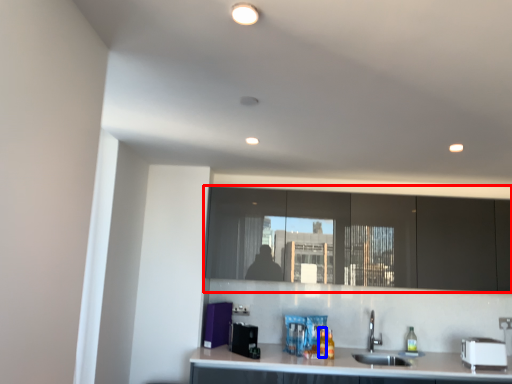
Question: Which point is closer to the camera, cabinetry (highlighted by a red box) or bottle (highlighted by a blue box)?

Choices:
 (A) cabinetry
 (B) bottle

Answer: (B)